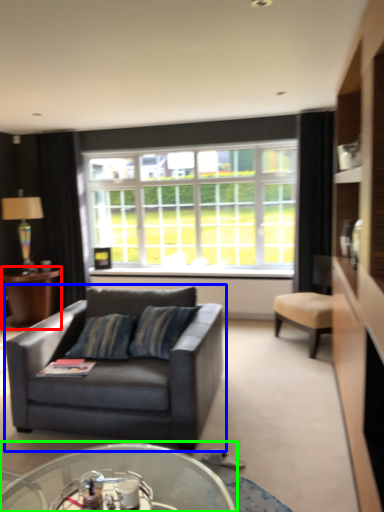
Question: Which is nearer to the table (highlighted by a red box)? studio couch (highlighted by a blue box) or coffee table (highlighted by a green box).

Choices:
 (A) studio couch
 (B) coffee table

Answer: (A)